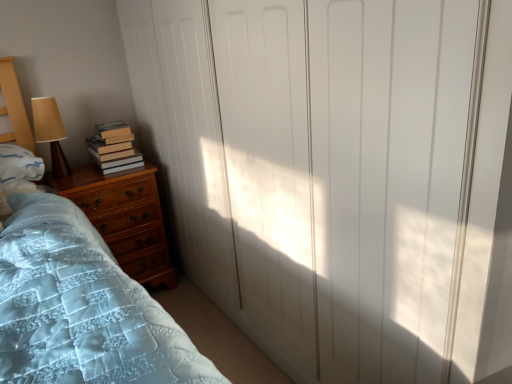
Question: Is hardcover books at left at the right side of brown fabric lampshade at left?

Choices:
 (A) yes
 (B) no

Answer: (A)

Question: From a real-world perspective, is hardcover books at left below brown fabric lampshade at left?

Choices:
 (A) yes
 (B) no

Answer: (A)

Question: Would you consider hardcover books at left to be distant from brown fabric lampshade at left?

Choices:
 (A) no
 (B) yes

Answer: (A)

Question: Considering the relative positions of hardcover books at left and brown fabric lampshade at left in the image provided, is hardcover books at left to the left of brown fabric lampshade at left from the viewer's perspective?

Choices:
 (A) no
 (B) yes

Answer: (A)

Question: Is hardcover books at left next to brown fabric lampshade at left?

Choices:
 (A) no
 (B) yes

Answer: (A)

Question: Does hardcover books at left come behind brown fabric lampshade at left?

Choices:
 (A) no
 (B) yes

Answer: (B)

Question: Considering the relative positions of hardcover books at left and wooden chest of drawers at lower left in the image provided, is hardcover books at left to the left of wooden chest of drawers at lower left from the viewer's perspective?

Choices:
 (A) yes
 (B) no

Answer: (B)

Question: From a real-world perspective, is hardcover books at left positioned over wooden chest of drawers at lower left based on gravity?

Choices:
 (A) no
 (B) yes

Answer: (B)

Question: Does hardcover books at left come behind wooden chest of drawers at lower left?

Choices:
 (A) yes
 (B) no

Answer: (A)

Question: Is hardcover books at left positioned in front of wooden chest of drawers at lower left?

Choices:
 (A) yes
 (B) no

Answer: (B)

Question: Is hardcover books at left at the right side of wooden chest of drawers at lower left?

Choices:
 (A) yes
 (B) no

Answer: (A)

Question: From the image's perspective, does hardcover books at left appear higher than wooden chest of drawers at lower left?

Choices:
 (A) no
 (B) yes

Answer: (B)

Question: From a real-world perspective, is white matte closet doors at center beneath brown fabric lampshade at left?

Choices:
 (A) yes
 (B) no

Answer: (A)